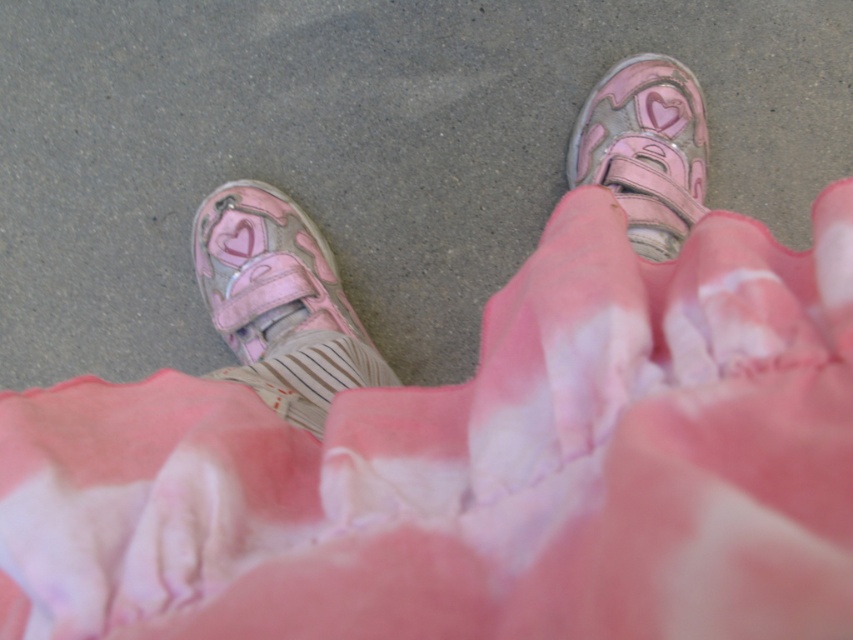
Question: Does pink matte shoe at lower left appear under shiny pink velcro shoe at center?

Choices:
 (A) yes
 (B) no

Answer: (A)

Question: In this image, where is pink matte shoe at lower left located relative to shiny pink velcro shoe at center?

Choices:
 (A) below
 (B) above

Answer: (A)

Question: Is pink matte shoe at lower left to the left of shiny pink velcro shoe at center from the viewer's perspective?

Choices:
 (A) no
 (B) yes

Answer: (B)

Question: Which point is farther to the camera?

Choices:
 (A) pink matte shoe at lower left
 (B) shiny pink velcro shoe at center

Answer: (B)